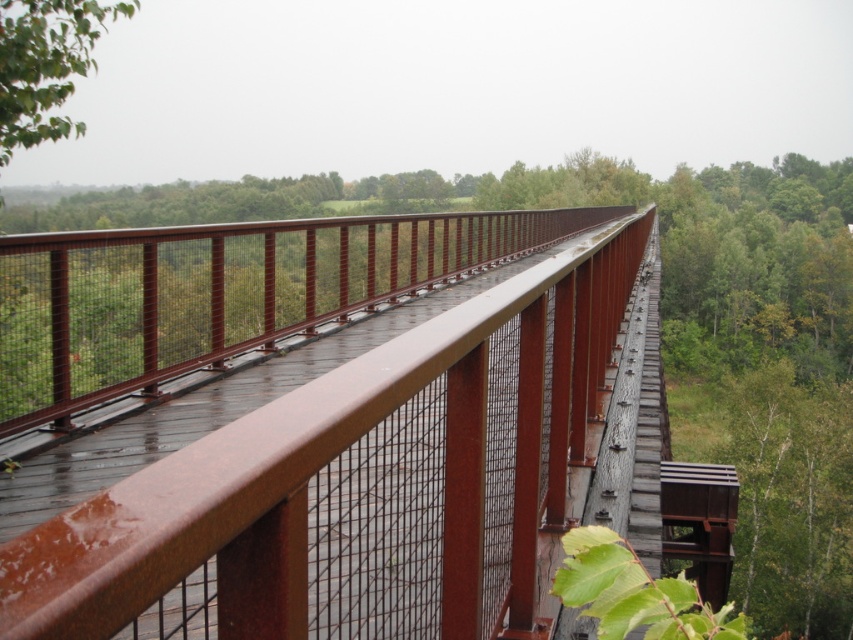
Between rusty metal bridge at center and green matte tree at upper left, which one has less height?

Standing shorter between the two is rusty metal bridge at center.

Is rusty metal bridge at center closer to camera compared to green matte tree at upper left?

Yes, rusty metal bridge at center is closer to the viewer.

The image size is (853, 640). I want to click on rusty metal bridge at center, so click(x=363, y=484).

What are the coordinates of `rusty metal bridge at center` in the screenshot? It's located at (363, 484).